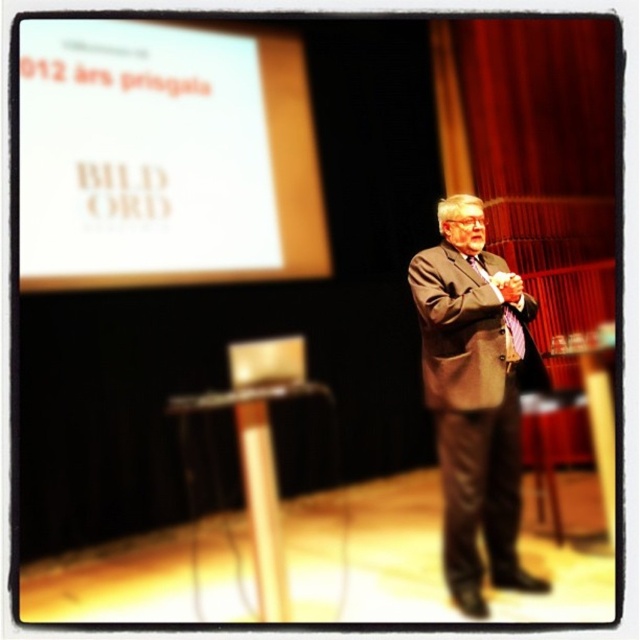
Is white paper at upper left shorter than brown suit at center?

Correct, white paper at upper left is not as tall as brown suit at center.

Is white paper at upper left below brown suit at center?

Actually, white paper at upper left is above brown suit at center.

Where is `white paper at upper left`? This screenshot has width=640, height=640. white paper at upper left is located at coordinates (164, 156).